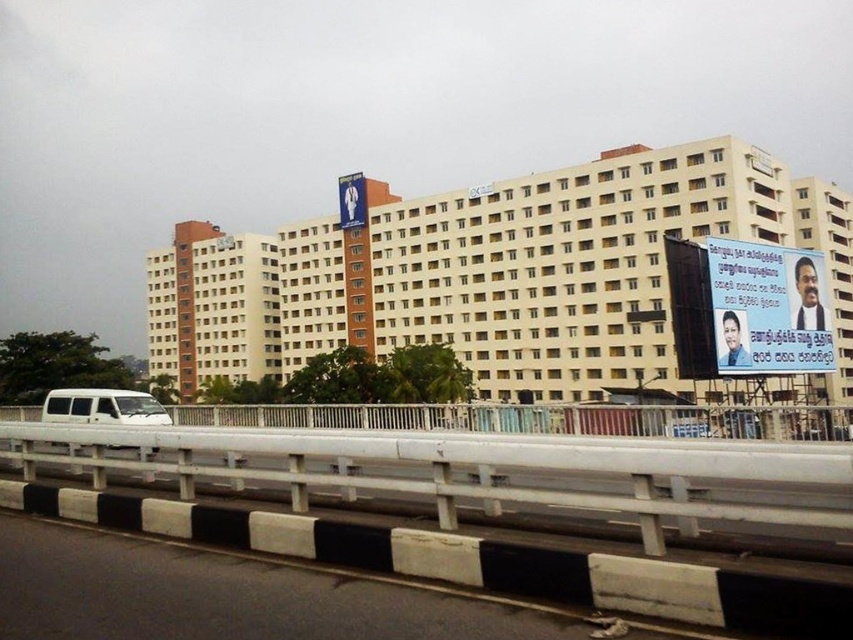
Question: Can you confirm if beige concrete building at center is positioned to the left of white glossy signboard at upper center?

Choices:
 (A) yes
 (B) no

Answer: (A)

Question: Which object appears closest to the camera in this image?

Choices:
 (A) white matte van at lower left
 (B) white glossy signboard at upper center
 (C) beige concrete building at center
 (D) blue glossy poster at upper right

Answer: (A)

Question: Which of the following is the closest to the observer?

Choices:
 (A) (352, 208)
 (B) (117, 396)

Answer: (B)

Question: Which point is closer to the camera taking this photo?

Choices:
 (A) (96, 392)
 (B) (344, 211)
 (C) (148, 371)

Answer: (A)

Question: Is blue glossy poster at upper right closer to the viewer compared to white matte van at lower left?

Choices:
 (A) no
 (B) yes

Answer: (A)

Question: In this image, where is beige concrete building at center located relative to blue glossy poster at upper right?

Choices:
 (A) below
 (B) above

Answer: (A)